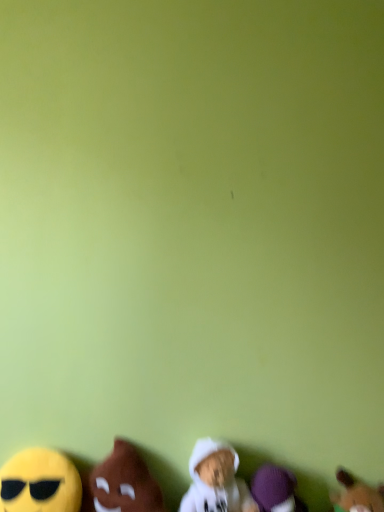
Question: Is brown plush toy at lower left, acting as the 4th toy starting from the right, behind white plush toy at lower center, which is the third toy from right to left?

Choices:
 (A) yes
 (B) no

Answer: (B)

Question: Is white plush toy at lower center, which is the third toy from right to left, at the back of brown plush toy at lower left, the second toy viewed from the left?

Choices:
 (A) yes
 (B) no

Answer: (B)

Question: Does brown plush toy at lower left, the second toy viewed from the left, have a lesser width compared to white plush toy at lower center, which is the third toy from right to left?

Choices:
 (A) no
 (B) yes

Answer: (A)

Question: Can you confirm if brown plush toy at lower left, acting as the 4th toy starting from the right, is taller than white plush toy at lower center, which is the third toy from right to left?

Choices:
 (A) no
 (B) yes

Answer: (A)

Question: Can white plush toy at lower center, positioned as the 3th toy in left-to-right order, be found inside brown plush toy at lower left, the second toy viewed from the left?

Choices:
 (A) yes
 (B) no

Answer: (B)

Question: Considering the relative positions of brown plush toy at lower left, the second toy viewed from the left, and white plush toy at lower center, positioned as the 3th toy in left-to-right order, in the image provided, is brown plush toy at lower left, the second toy viewed from the left, to the left of white plush toy at lower center, positioned as the 3th toy in left-to-right order, from the viewer's perspective?

Choices:
 (A) no
 (B) yes

Answer: (B)

Question: From the image's perspective, is yellow plush toy at lower left, the 5th toy when ordered from right to left, above brown plush toy at lower left, the second toy viewed from the left?

Choices:
 (A) yes
 (B) no

Answer: (A)

Question: Is yellow plush toy at lower left, positioned as the 1th toy in left-to-right order, far from brown plush toy at lower left, acting as the 4th toy starting from the right?

Choices:
 (A) yes
 (B) no

Answer: (B)

Question: Is yellow plush toy at lower left, the 5th toy when ordered from right to left, thinner than brown plush toy at lower left, the second toy viewed from the left?

Choices:
 (A) no
 (B) yes

Answer: (B)

Question: Is the position of yellow plush toy at lower left, the 5th toy when ordered from right to left, less distant than that of brown plush toy at lower left, the second toy viewed from the left?

Choices:
 (A) no
 (B) yes

Answer: (B)

Question: Would you say yellow plush toy at lower left, positioned as the 1th toy in left-to-right order, contains brown plush toy at lower left, the second toy viewed from the left?

Choices:
 (A) no
 (B) yes

Answer: (A)

Question: Does yellow plush toy at lower left, positioned as the 1th toy in left-to-right order, have a greater height compared to brown plush toy at lower left, the second toy viewed from the left?

Choices:
 (A) no
 (B) yes

Answer: (A)

Question: Is purple plush toy at lower right, which is counted as the 4th toy, starting from the left, wider than white plush toy at lower center, which is the third toy from right to left?

Choices:
 (A) yes
 (B) no

Answer: (B)